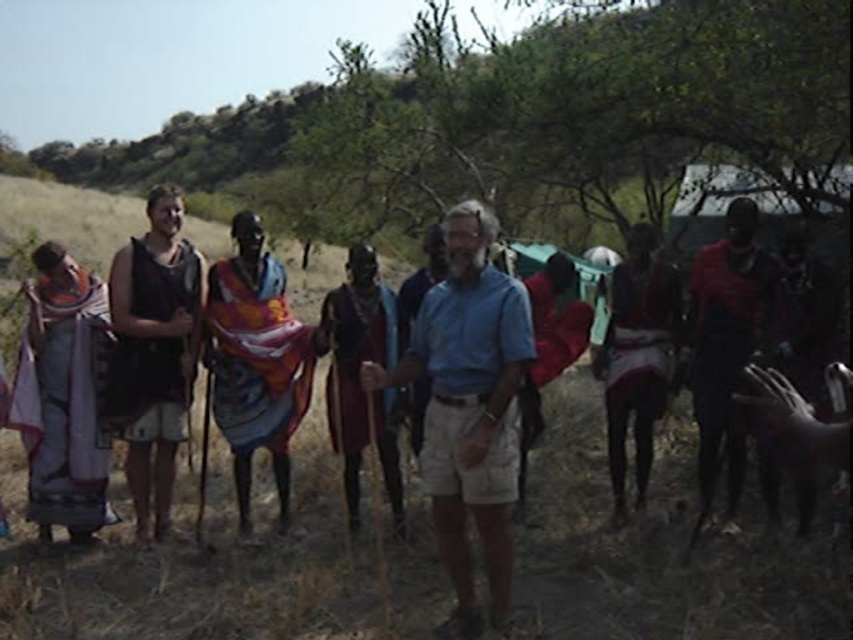
Question: Is textured fabric shawl at left in front of dark brown leather dress at center?

Choices:
 (A) yes
 (B) no

Answer: (B)

Question: Among these points, which one is farthest from the camera?

Choices:
 (A) (338, 289)
 (B) (738, 257)

Answer: (A)

Question: Which of the following is the closest to the observer?

Choices:
 (A) (283, 490)
 (B) (183, 324)
 (C) (633, 410)
 (D) (416, 376)

Answer: (D)

Question: Does multicolored fabric at center appear on the left side of dark brown leather dress at center?

Choices:
 (A) yes
 (B) no

Answer: (A)

Question: Is black fabric at left positioned at the back of textured fabric dress at right?

Choices:
 (A) no
 (B) yes

Answer: (A)

Question: Which of these objects is positioned farthest from the dark brown leather dress at center?

Choices:
 (A) multicolored fabric at center
 (B) textured fabric shawl at left

Answer: (B)